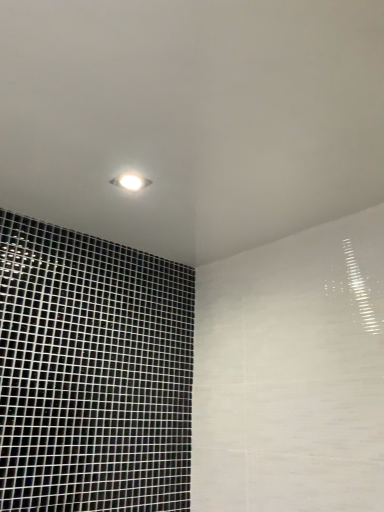
The height and width of the screenshot is (512, 384). I want to click on white glossy light fixture at upper center, so click(x=130, y=182).

The width and height of the screenshot is (384, 512). Describe the element at coordinates (130, 182) in the screenshot. I see `white glossy light fixture at upper center` at that location.

The height and width of the screenshot is (512, 384). What are the coordinates of `white glossy light fixture at upper center` in the screenshot? It's located at (130, 182).